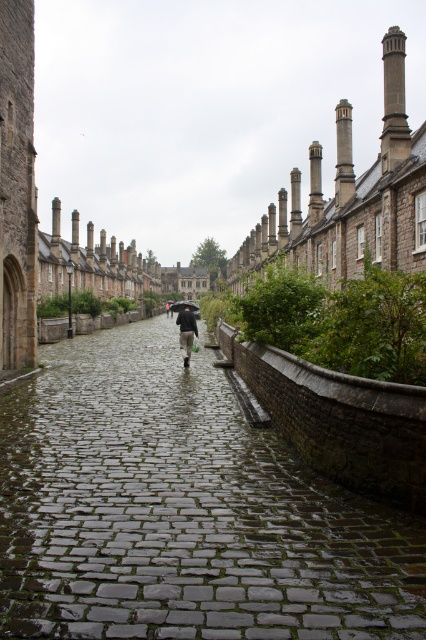
Can you confirm if wet cobblestone pavement at center is positioned above black matte umbrella at center?

No.

Is point (58, 387) farther from camera compared to point (187, 301)?

No, (58, 387) is closer to viewer.

The image size is (426, 640). Find the location of `wet cobblestone pavement at center`. wet cobblestone pavement at center is located at coordinates point(181,509).

Locate an element on the screen. Image resolution: width=426 pixels, height=640 pixels. wet cobblestone pavement at center is located at coordinates (181, 509).

Does dark gray fabric jacket at center lie behind black matte umbrella at center?

No.

Is dark gray fabric jacket at center to the right of black matte umbrella at center from the viewer's perspective?

Yes, dark gray fabric jacket at center is to the right of black matte umbrella at center.

Is point (192, 321) closer to viewer compared to point (190, 301)?

That is True.

At what (x,y) coordinates should I click in order to perform the action: click on dark gray fabric jacket at center. Please return your answer as a coordinate pair (x, y). Image resolution: width=426 pixels, height=640 pixels. Looking at the image, I should click on (186, 332).

Is wet cobblestone pavement at center to the right of dark gray fabric jacket at center from the viewer's perspective?

Incorrect, wet cobblestone pavement at center is not on the right side of dark gray fabric jacket at center.

Which is behind, point (164, 627) or point (190, 323)?

Point (190, 323)

Image resolution: width=426 pixels, height=640 pixels. Describe the element at coordinates (181, 509) in the screenshot. I see `wet cobblestone pavement at center` at that location.

Identify the location of wet cobblestone pavement at center. The width and height of the screenshot is (426, 640). (181, 509).